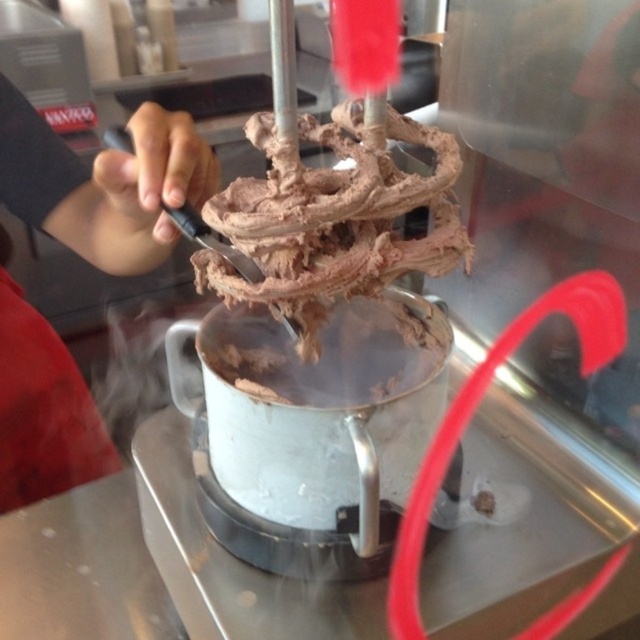
You are a food preparer trying to reach the chocolate matte ice cream at center without touching the hot base. Since the smooth skin hand at upper left is holding the tool, can you safely reach the ice cream by moving your hand from the current position?

The smooth skin hand at upper left is to the left of the chocolate matte ice cream at center, so moving the hand from its current position towards the center would allow reaching the ice cream without interfering with the hot base on the right side.

You are a food safety inspector checking the kitchen. You see the smooth skin hand at upper left and the chocolate matte ice cream at center. According to food safety guidelines, should the hand be closer to the ice cream than it currently is?

The chocolate matte ice cream at center is behind the smooth skin hand at upper left, meaning the hand is farther away from the ice cream. According to food safety guidelines, the hand should maintain a safe distance to prevent contamination, so the current positioning complies with the guidelines.

You are a food inspector checking the preparation of the chocolate matte ice cream at center. You notice the smooth skin hand at upper left is holding a tool near it. Based on their positions, which object is higher in the image?

The smooth skin hand at upper left is taller than the chocolate matte ice cream at center, so the smooth skin hand at upper left is higher in the image.